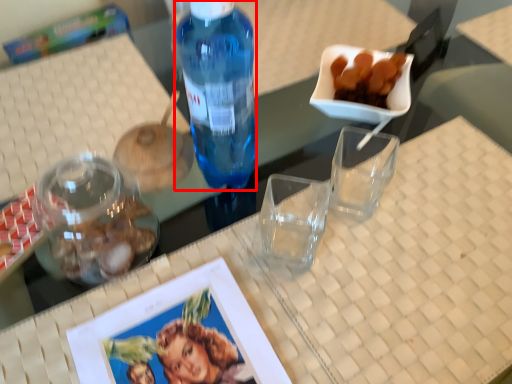
Question: From the image's perspective, where is bottle (annotated by the red box) located in relation to tableware in the image?

Choices:
 (A) above
 (B) below

Answer: (A)